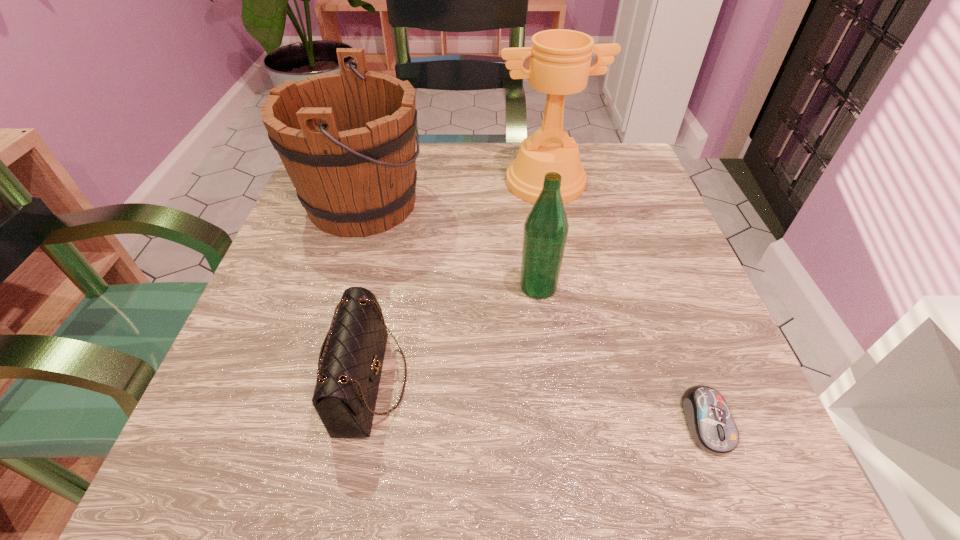
Where is `vacant space that is in between the award and the wine bucket`? The width and height of the screenshot is (960, 540). vacant space that is in between the award and the wine bucket is located at coordinates (454, 193).

Image resolution: width=960 pixels, height=540 pixels. What are the coordinates of `vacant point located between the shortest object and the bottle` in the screenshot? It's located at (622, 354).

This screenshot has height=540, width=960. What are the coordinates of `free space between the computer mouse and the wine bucket` in the screenshot? It's located at (535, 313).

The height and width of the screenshot is (540, 960). I want to click on blank region between the bottle and the clutch bag, so click(454, 334).

Identify the location of free space between the award and the computer mouse. (626, 302).

This screenshot has height=540, width=960. Find the location of `object identified as the fourth closest to the clutch bag`. object identified as the fourth closest to the clutch bag is located at coordinates (710, 423).

The width and height of the screenshot is (960, 540). I want to click on object that ranks as the third closest to the bottle, so click(560, 59).

The width and height of the screenshot is (960, 540). Identify the location of free location that satisfies the following two spatial constraints: 1. on the side of the wine bucket with the handle for carrying; 2. on the right side of the bottle. (338, 287).

The height and width of the screenshot is (540, 960). I want to click on free space in the image that satisfies the following two spatial constraints: 1. on the side of the wine bucket with the handle for carrying; 2. on the right side of the bottle, so click(338, 287).

I want to click on blank area in the image that satisfies the following two spatial constraints: 1. on the side of the wine bucket with the handle for carrying; 2. on the back side of the third nearest object, so click(x=338, y=287).